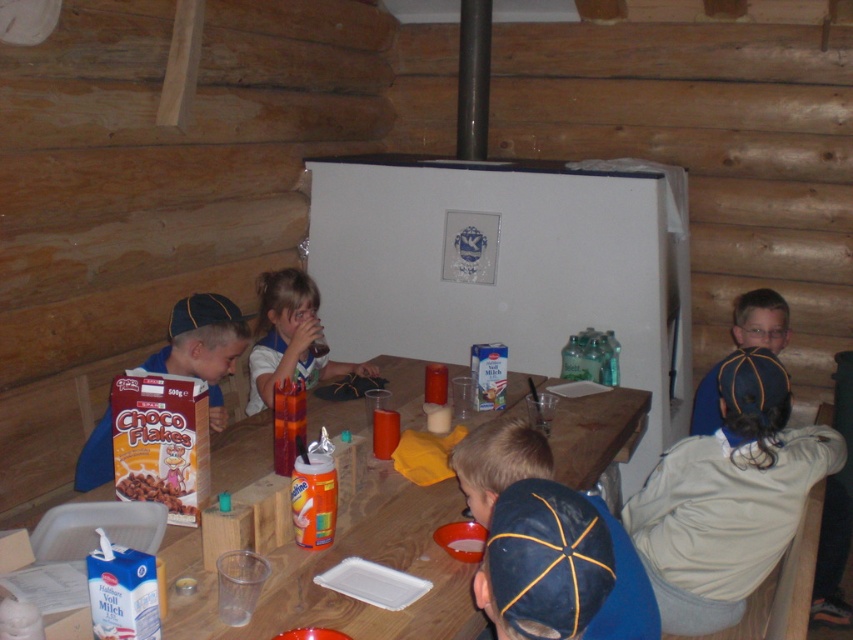
You are a child sitting at the table in the rustic log cabin. You want to reach for the matte cardboard cereal box at lower left without knocking over the translucent plastic cup at center. Is the cereal box positioned in a way that allows you to grab it easily?

The matte cardboard cereal box at lower left is located below the translucent plastic cup at center, so you can safely reach for it without disturbing the cup.